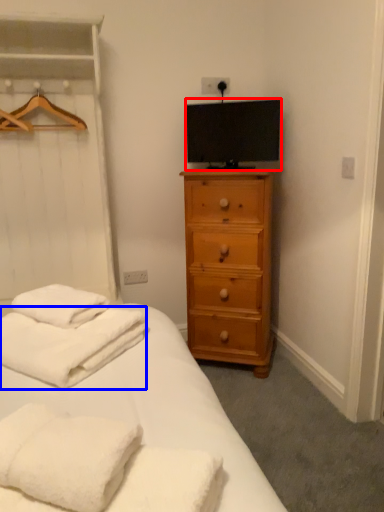
Question: Among these objects, which one is nearest to the camera, television (highlighted by a red box) or bath towel (highlighted by a blue box)?

Choices:
 (A) television
 (B) bath towel

Answer: (B)